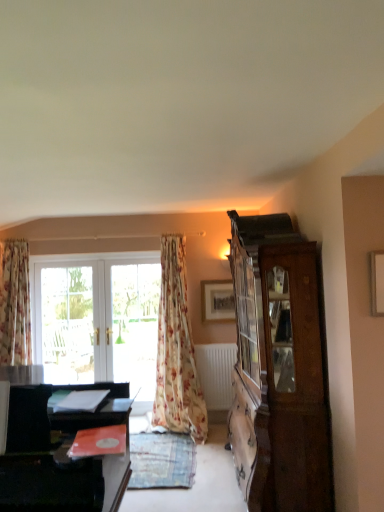
Question: Considering the relative sizes of white matte radiator at lower center and white glossy screen door at center in the image provided, is white matte radiator at lower center smaller than white glossy screen door at center?

Choices:
 (A) yes
 (B) no

Answer: (A)

Question: From a real-world perspective, does white matte radiator at lower center sit lower than white glossy screen door at center?

Choices:
 (A) yes
 (B) no

Answer: (A)

Question: Is white matte radiator at lower center thinner than white glossy screen door at center?

Choices:
 (A) yes
 (B) no

Answer: (B)

Question: From the image's perspective, is white matte radiator at lower center over white glossy screen door at center?

Choices:
 (A) no
 (B) yes

Answer: (A)

Question: Is white matte radiator at lower center to the right of white glossy screen door at center from the viewer's perspective?

Choices:
 (A) no
 (B) yes

Answer: (B)

Question: Is white glossy screen door at center at the back of white matte radiator at lower center?

Choices:
 (A) yes
 (B) no

Answer: (B)

Question: Considering the relative sizes of white glossy screen door at center and wooden cabinet at right in the image provided, is white glossy screen door at center shorter than wooden cabinet at right?

Choices:
 (A) yes
 (B) no

Answer: (A)

Question: Is white glossy screen door at center looking in the opposite direction of wooden cabinet at right?

Choices:
 (A) yes
 (B) no

Answer: (B)

Question: Considering the relative sizes of white glossy screen door at center and wooden cabinet at right in the image provided, is white glossy screen door at center smaller than wooden cabinet at right?

Choices:
 (A) yes
 (B) no

Answer: (A)

Question: Considering the relative positions of white glossy screen door at center and wooden cabinet at right in the image provided, is white glossy screen door at center behind wooden cabinet at right?

Choices:
 (A) yes
 (B) no

Answer: (A)

Question: Is white glossy screen door at center closer to the viewer compared to wooden cabinet at right?

Choices:
 (A) no
 (B) yes

Answer: (A)

Question: From the image's perspective, is white glossy screen door at center beneath wooden cabinet at right?

Choices:
 (A) no
 (B) yes

Answer: (B)

Question: Can you confirm if floral fabric curtain at left, which is the 2th curtain from right to left, is bigger than wooden cabinet at right?

Choices:
 (A) yes
 (B) no

Answer: (B)